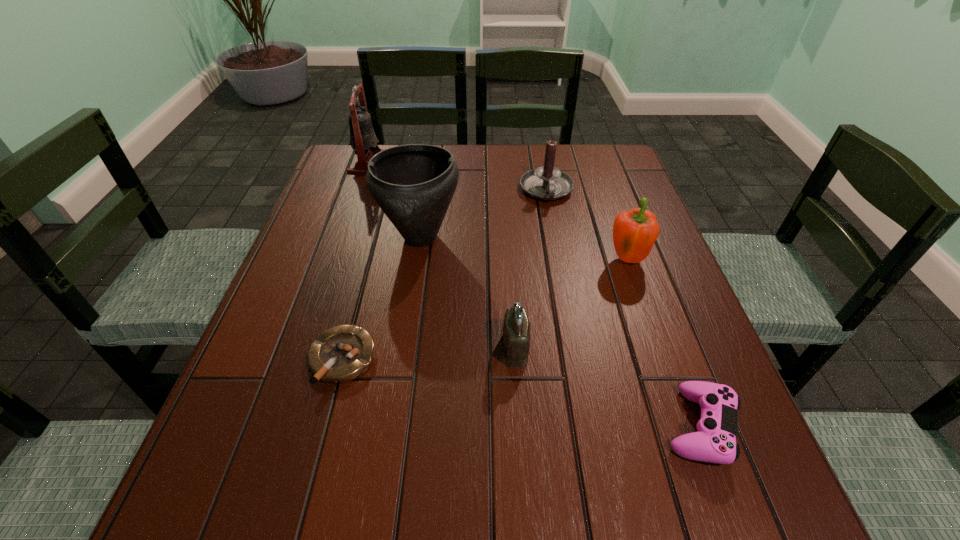
I want to click on free point that satisfies the following two spatial constraints: 1. at the front of the control near the keyhole; 2. on the right side of the fourth object from left to right, so click(520, 427).